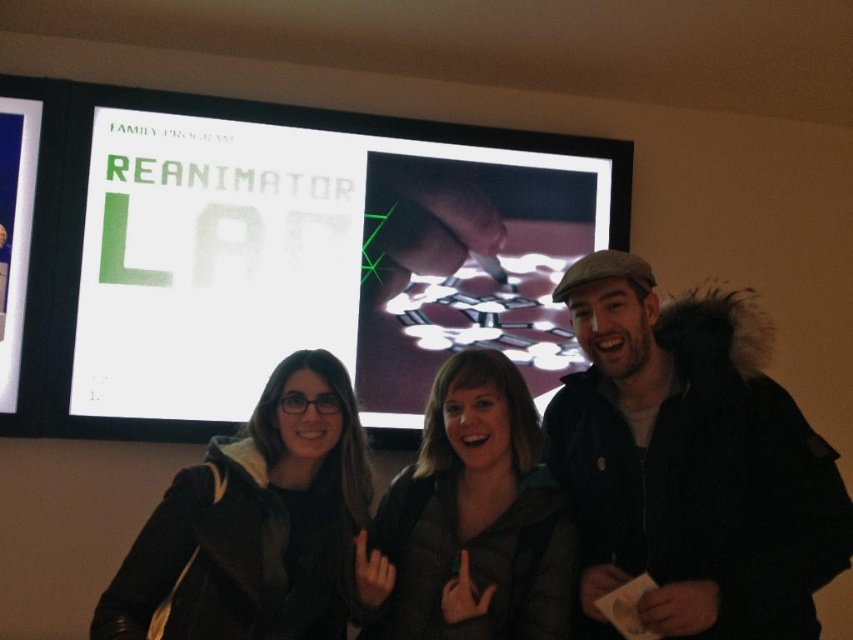
Question: Which object appears farthest from the camera in this image?

Choices:
 (A) dark brown leather jacket at center
 (B) black matte jacket at center
 (C) white glossy projection screen at upper center

Answer: (C)

Question: Can you confirm if white glossy projection screen at upper center is bigger than dark brown leather jacket at center?

Choices:
 (A) yes
 (B) no

Answer: (A)

Question: Which object is positioned closest to the white glossy projection screen at upper center?

Choices:
 (A) black matte jacket at center
 (B) dark brown leather jacket at center

Answer: (A)

Question: Which point appears closest to the camera in this image?

Choices:
 (A) (195, 152)
 (B) (442, 372)
 (C) (200, 540)

Answer: (C)

Question: Can you confirm if white glossy projection screen at upper center is positioned to the left of dark brown leather jacket at center?

Choices:
 (A) yes
 (B) no

Answer: (A)

Question: Can you confirm if black matte jacket at center is positioned to the left of dark brown leather jacket at center?

Choices:
 (A) yes
 (B) no

Answer: (A)